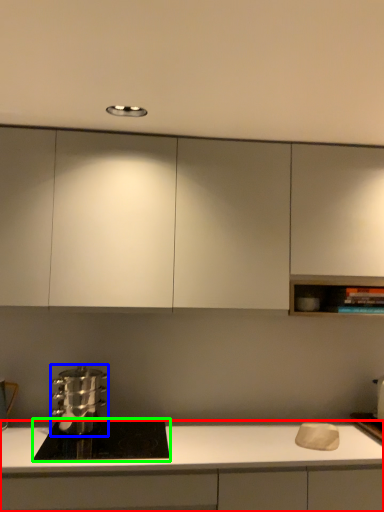
Question: Which is farther away from cabinetry (highlighted by a red box)? kitchen appliance (highlighted by a blue box) or home appliance (highlighted by a green box)?

Choices:
 (A) kitchen appliance
 (B) home appliance

Answer: (A)